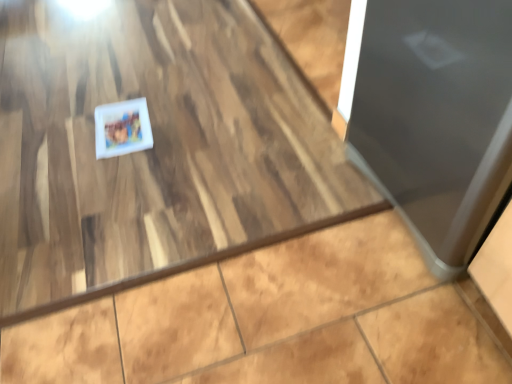
Find the location of a particular element. The width and height of the screenshot is (512, 384). free point behind white matte postcard at center is located at coordinates (133, 91).